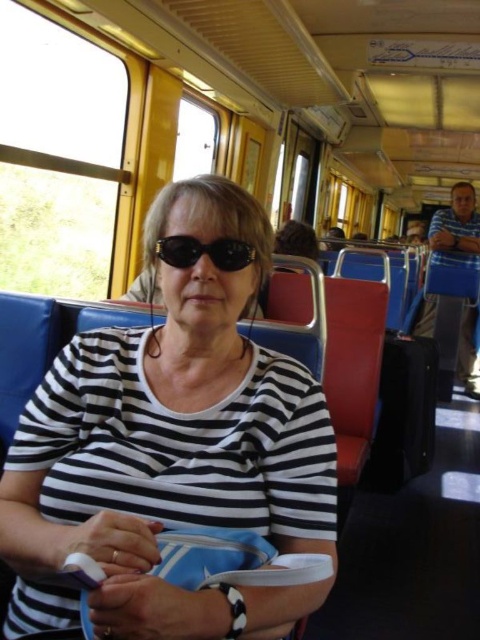
Describe the element at coordinates (170, 449) in the screenshot. I see `black striped shirt at center` at that location.

Is black striped shirt at center thinner than blue fabric coach at right?

Incorrect, black striped shirt at center's width is not less than blue fabric coach at right's.

Does point (143, 492) come in front of point (456, 237)?

That is True.

Where is `black striped shirt at center`? black striped shirt at center is located at coordinates (170, 449).

Is black striped shirt at center shorter than black rubber goggles at center?

Incorrect, black striped shirt at center's height does not fall short of black rubber goggles at center's.

Which is behind, point (110, 371) or point (229, 272)?

The point (110, 371) is more distant.

Locate an element on the screen. black striped shirt at center is located at coordinates (170, 449).

Can you confirm if blue fabric coach at right is wider than black rubber goggles at center?

Yes.

Can you confirm if blue fabric coach at right is bigger than black rubber goggles at center?

Yes.

The image size is (480, 640). What do you see at coordinates (456, 228) in the screenshot?
I see `blue fabric coach at right` at bounding box center [456, 228].

The image size is (480, 640). In order to click on blue fabric coach at right in this screenshot , I will do `click(456, 228)`.